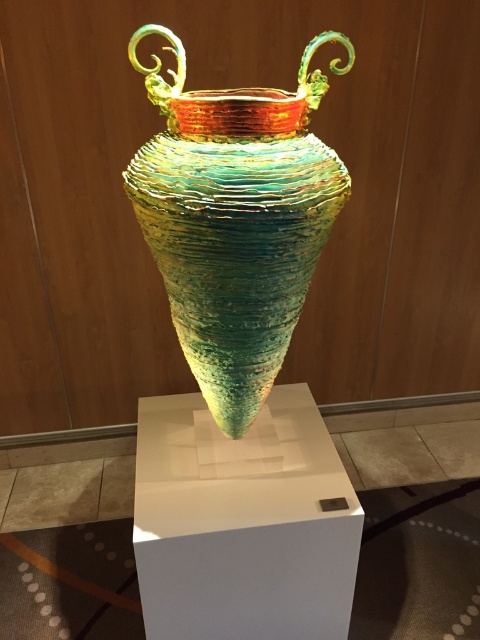
You are an art curator examining the image of the vase. You need to determine the exact location of the point marked at coordinates (236, 220). Based on the description, what object does this point correspond to?

The point at coordinates (236, 220) corresponds to the translucent glass vase at center.

You are an art conservator examining the vase from the front. You notice two points marked on the vase at coordinates point [165,193] and point [231,536]. Which point is closer to you?

Point [165,193] is closer to the viewer than point [231,536].

You are an art curator arranging a display. You need to place a small label next to the white matte pedestal at center so visitors can read about the translucent glass vase at center. Based on their positions, should the label be placed to the left or right of the pedestal?

The translucent glass vase at center is to the left of the white matte pedestal at center, so the label should be placed to the right of the pedestal to avoid blocking the view of the vase.